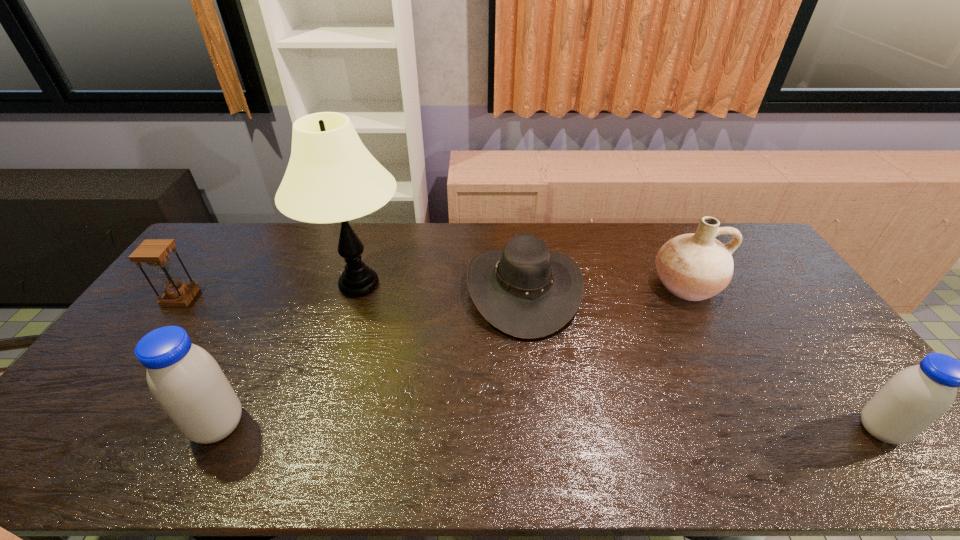
Please point a space for a new soya_milk to maintain equal intervals. Please provide its 2D coordinates. Your answer should be formatted as a tuple, i.e. [(x, y)], where the tuple contains the x and y coordinates of a point satisfying the conditions above.

[(548, 428)]